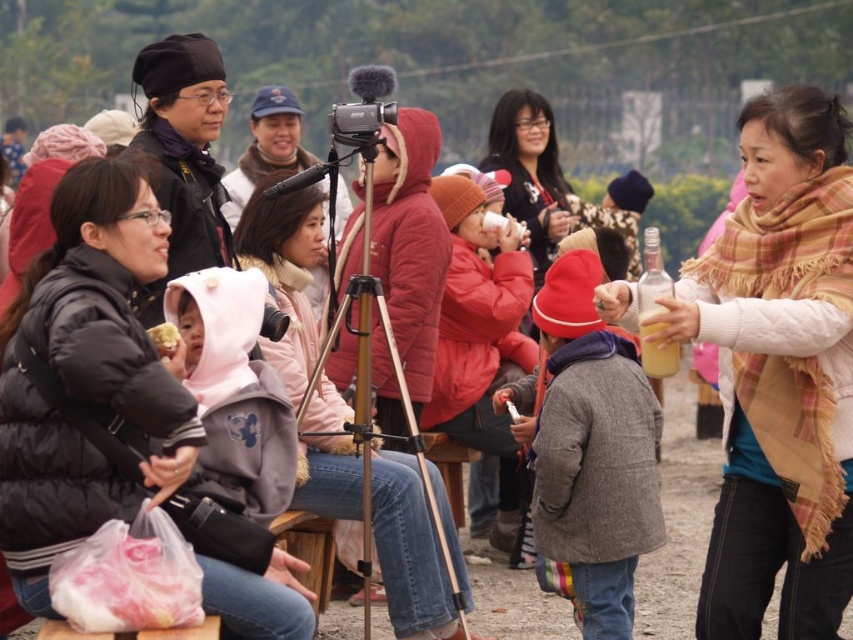
You are organizing a photo shoot in the park and need to position your equipment. You have a black puffy jacket at left and a black matte tripod at center. Which object is closer to the left edge of the photo?

The black puffy jacket at left is closer to the left edge of the photo because it is positioned to the left of the black matte tripod at center.

You are a photographer at the gathering and you want to take a photo of the plaid scarf at center without the black matte tripod at center blocking the view. Can you adjust your position to achieve this?

The plaid scarf at center is located below the black matte tripod at center, so you can lower your camera angle or move to a lower position to avoid the tripod blocking the scarf.